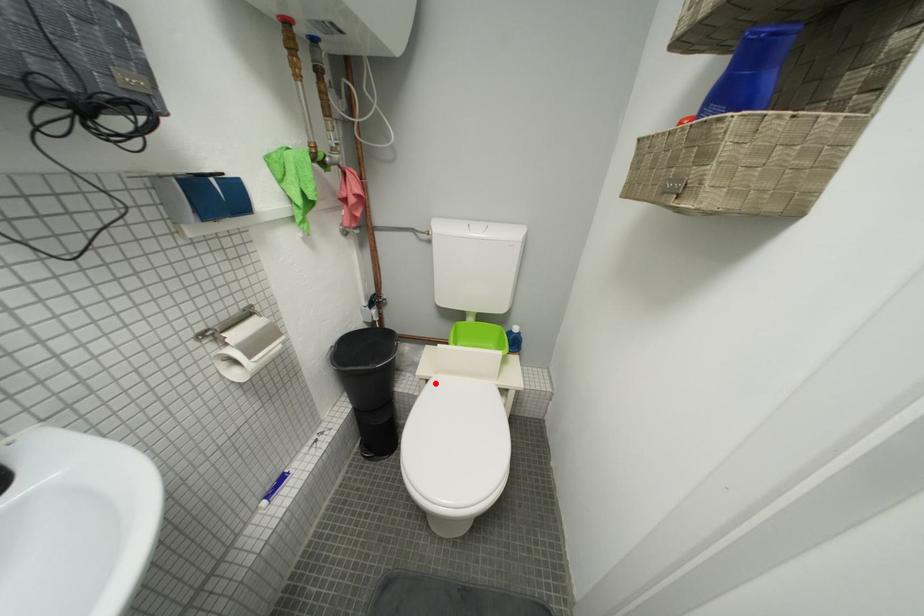
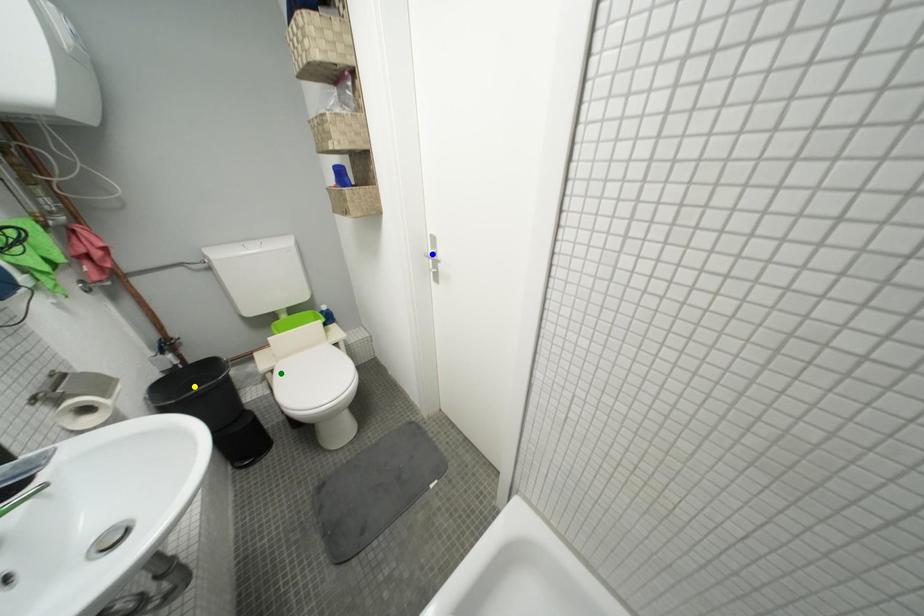
Question: I am providing you with two images of the same scene from different viewpoints. A red point is marked on the first image. You are given multiple points on the second image. Which mark in image 2 goes with the point in image 1?

Choices:
 (A) blue point
 (B) green point
 (C) yellow point

Answer: (B)